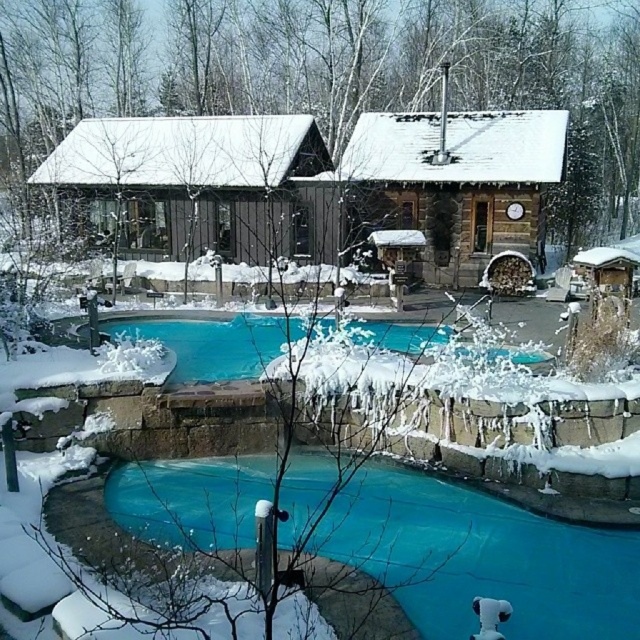
Question: Does brown wooden cabin at center lie behind wooden cabin at center?

Choices:
 (A) no
 (B) yes

Answer: (B)

Question: Which point is farther to the camera?

Choices:
 (A) blue glassy swimming pool at center
 (B) blue tarp at lower center
 (C) wooden cabin at center
 (D) brown wooden cabin at center

Answer: (D)

Question: Among these points, which one is farthest from the camera?

Choices:
 (A) (324, 324)
 (B) (536, 180)
 (C) (193, 124)

Answer: (C)

Question: Is brown wooden cabin at center closer to camera compared to blue glassy swimming pool at center?

Choices:
 (A) no
 (B) yes

Answer: (A)

Question: Which point is farther from the camera taking this photo?

Choices:
 (A) (522, 129)
 (B) (419, 340)
 (C) (228, 120)
 (D) (540, 556)

Answer: (C)

Question: Is brown wooden cabin at center below wooden cabin at center?

Choices:
 (A) no
 (B) yes

Answer: (B)